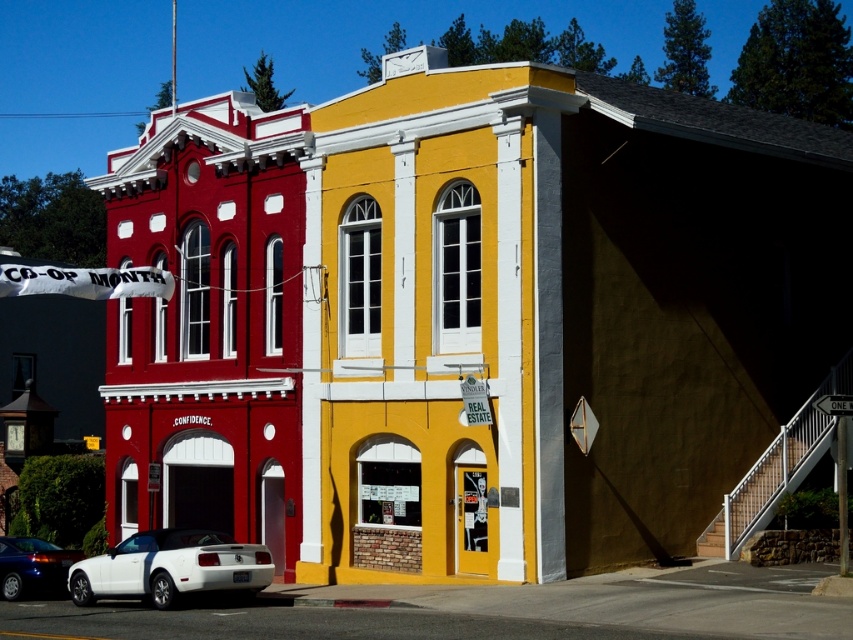
You are standing 30 meters away from a white matte convertible at lower left. Can you safely walk to it without needing to move any obstacles?

The white matte convertible at lower left is 28.84 meters away from the viewer, so you are currently 30 meters away. This means you are slightly farther away than the actual distance. To reach it, you would need to walk forward about 1.16 meters, and there are no obstacles mentioned in the scene description, so you can safely walk to it.

In the scene shown: You are standing in front of the two story building and want to determine the relative positions of two points marked on the building. Which point is closer to you, point (177, 586) or point (38, 579)?

Point (177, 586) is closer to the viewer than point (38, 579).